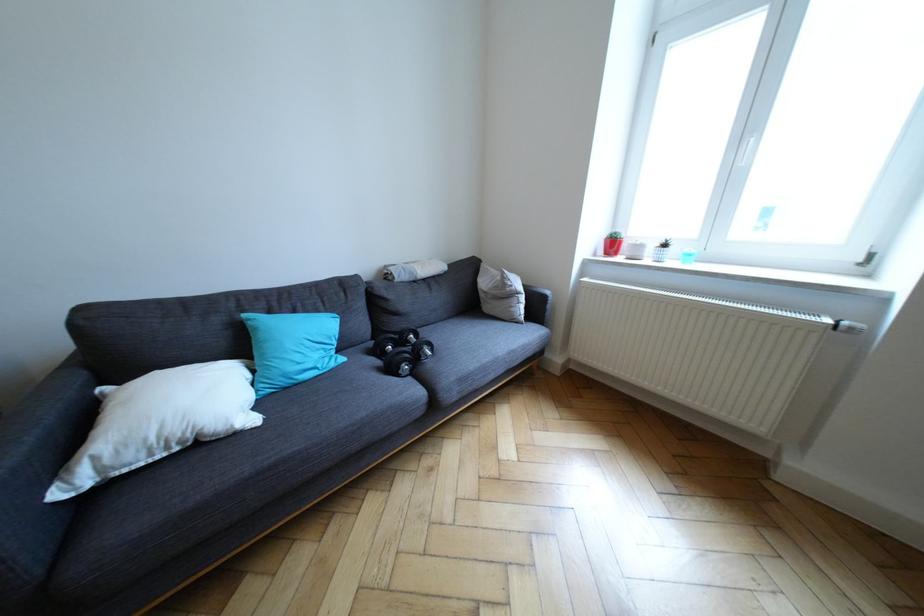
Find where to turn the window handle. Please return your answer as a coordinate pair (x, y).

(746, 148)